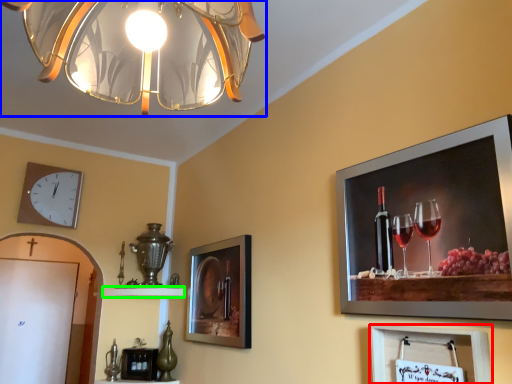
Question: Which is farther away from picture frame (highlighted by a red box)? lamp (highlighted by a blue box) or shelf (highlighted by a green box)?

Choices:
 (A) lamp
 (B) shelf

Answer: (B)